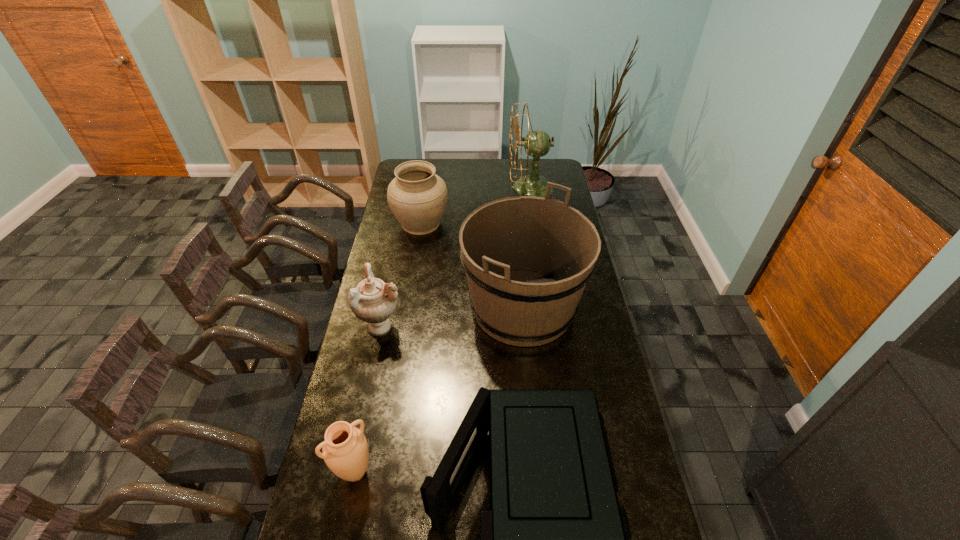
This screenshot has width=960, height=540. Identify the location of vacant space situated on the right of the second nearest urn. (438, 326).

Locate an element on the screen. The height and width of the screenshot is (540, 960). free location located on the right of the nearest urn is located at coordinates (492, 472).

Where is `object located in the far edge section of the desktop`? object located in the far edge section of the desktop is located at coordinates (537, 143).

Identify the location of fan situated at the right edge. The image size is (960, 540). (537, 143).

At what (x,y) coordinates should I click in order to perform the action: click on bucket that is at the right edge. Please return your answer as a coordinate pair (x, y). The width and height of the screenshot is (960, 540). Looking at the image, I should click on (527, 259).

Image resolution: width=960 pixels, height=540 pixels. What are the coordinates of `object that is at the far right corner` in the screenshot? It's located at (537, 143).

Identify the location of vacant space at the far edge. (518, 166).

Image resolution: width=960 pixels, height=540 pixels. In the image, there is a desktop. Find the location of `vacant space at the left edge`. vacant space at the left edge is located at coordinates (367, 354).

This screenshot has height=540, width=960. In order to click on free space at the right edge of the desktop in this screenshot , I will do `click(625, 441)`.

In order to click on free region at the far right corner of the desktop in this screenshot , I will do `click(540, 173)`.